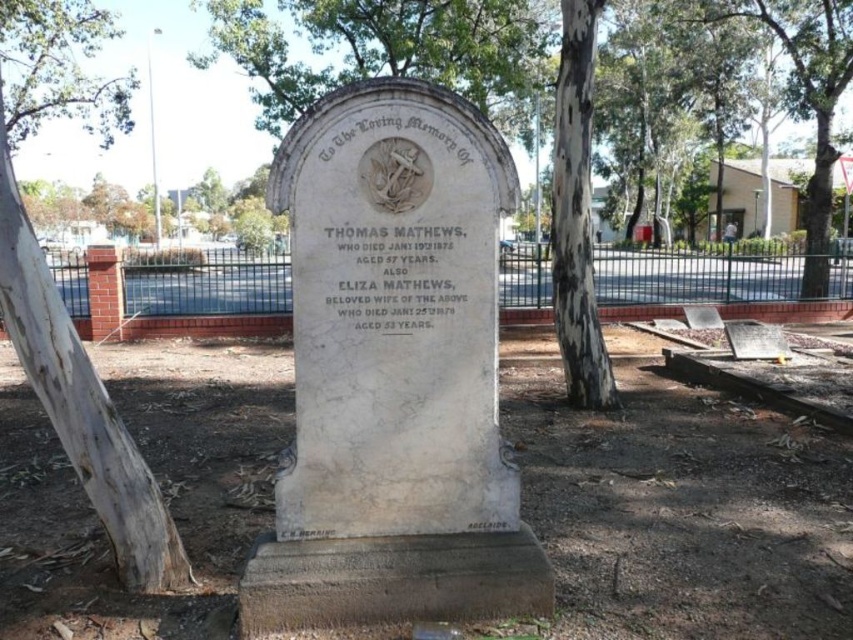
Question: Which object appears farthest from the camera in this image?

Choices:
 (A) white bark tree at upper center
 (B) white marble gravestone at center

Answer: (A)

Question: Is white marble gravestone at center below white bark tree at upper center?

Choices:
 (A) no
 (B) yes

Answer: (B)

Question: Is white marble gravestone at center smaller than green leafy tree at upper left?

Choices:
 (A) no
 (B) yes

Answer: (A)

Question: From the image, what is the correct spatial relationship of green leafy tree at upper center in relation to green leafy tree at upper left?

Choices:
 (A) above
 (B) below

Answer: (A)

Question: Among these points, which one is farthest from the camera?

Choices:
 (A) (508, 170)
 (B) (279, 52)
 (C) (579, 35)

Answer: (B)

Question: Which point is farther from the camera taking this photo?

Choices:
 (A) (474, 157)
 (B) (425, 56)
 (C) (73, 192)
 (D) (122, 96)

Answer: (C)